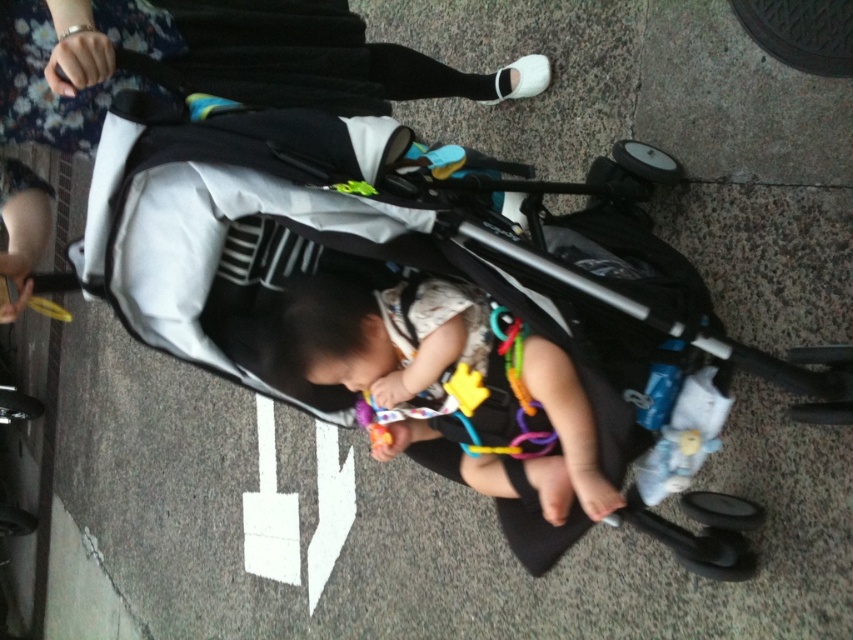
You are standing at the origin point of the image. The white fabric stroller at center is at coordinates 0.097, 0.253. If you want to move towards the stroller, which direction should you go?

Since the white fabric stroller at center is located at coordinates (215, 61), you should move towards the lower right direction to reach it.

Looking at this image, you are a pedestrian walking on the sidewalk and see the black fabric baby carriage at center and the white fabric stroller at center. Which one is closer to you?

The black fabric baby carriage at center is closer to you because the white fabric stroller at center is positioned behind it.

You are a delivery robot that needs to pass between the black fabric baby carriage at center and the white fabric stroller at center. The robot is 22 inches wide. Can you fit through the space between them?

The black fabric baby carriage at center is 23.08 inches from the white fabric stroller at center. Since the robot is 22 inches wide, it can fit through the space between them as there is enough clearance.